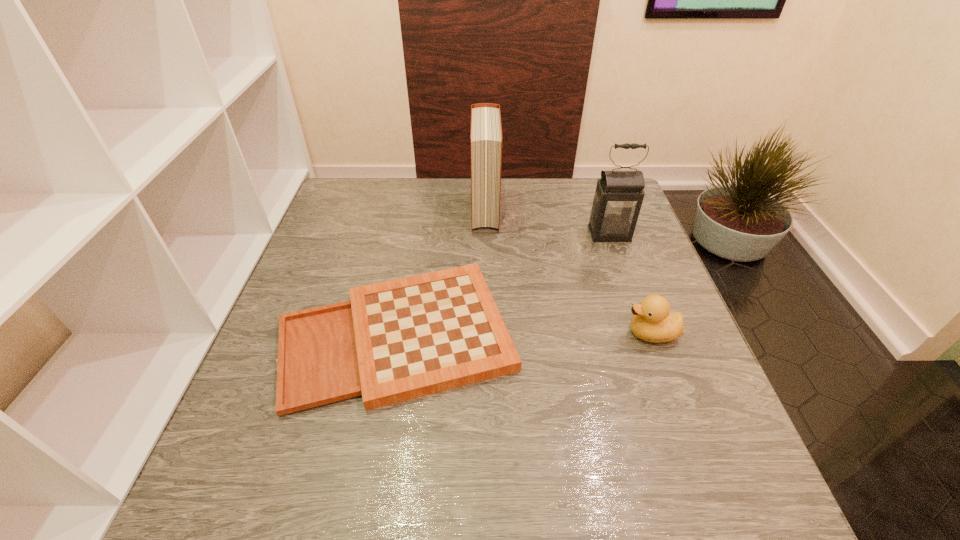
Locate an element on the screen. The image size is (960, 540). hardback book is located at coordinates (486, 138).

Find the location of `lantern`. lantern is located at coordinates (618, 198).

Locate an element on the screen. This screenshot has height=540, width=960. duckling is located at coordinates [653, 322].

In order to click on the shortest object in this screenshot , I will do `click(393, 341)`.

Locate an element on the screen. free spot located on the open cover of the hardback book is located at coordinates (486, 269).

Image resolution: width=960 pixels, height=540 pixels. I want to click on vacant space located on the front-facing side of the lantern, so click(625, 277).

Find the location of `free location located 0.390m facing forward on the second shortest object`. free location located 0.390m facing forward on the second shortest object is located at coordinates (444, 333).

I want to click on free space located facing forward on the second shortest object, so tap(583, 333).

The height and width of the screenshot is (540, 960). What are the coordinates of `free space located facing forward on the second shortest object` in the screenshot? It's located at (591, 333).

This screenshot has height=540, width=960. I want to click on blank area located 0.070m on the right of the gameboard, so click(550, 334).